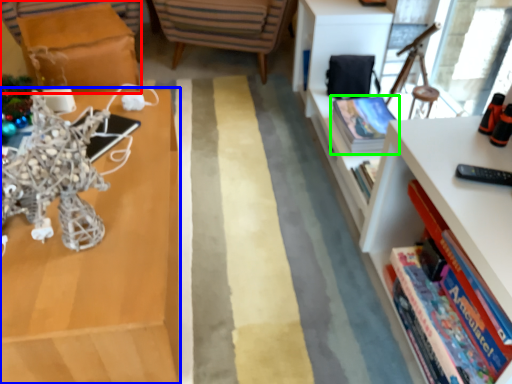
Question: Which object is the farthest from table (highlighted by a red box)? Choose among these: shelf (highlighted by a blue box) or book (highlighted by a green box).

Choices:
 (A) shelf
 (B) book

Answer: (B)